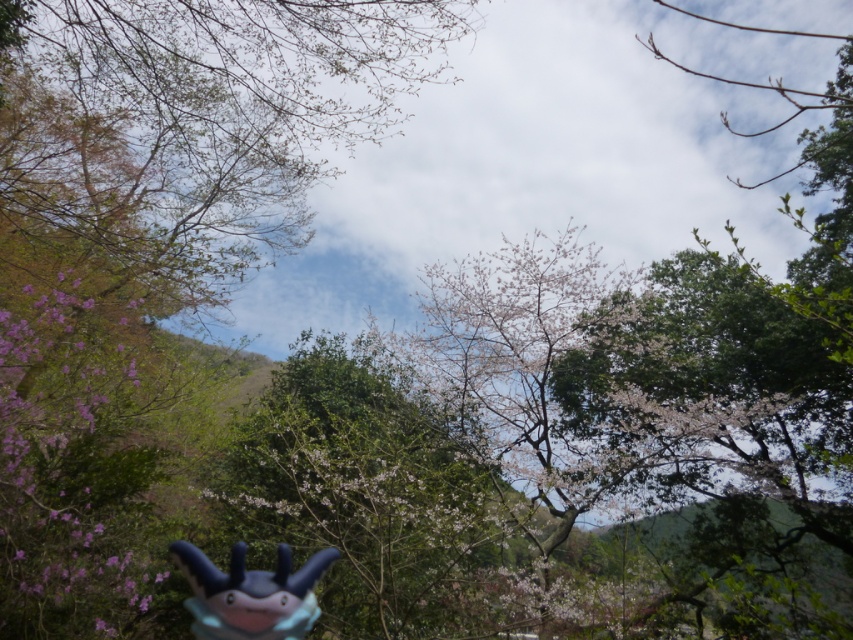
In the scene shown: You are a child playing in the garden and you see the pink matte flower at left and the matte blue plush toy at bottom center. Which object is positioned lower in the scene?

The pink matte flower at left is located below the matte blue plush toy at bottom center, so it is positioned lower in the scene.

You are a child playing in the park and you see the pink matte flower at left and the matte blue plush toy at bottom center. Which object is located to the left of the other?

→ The pink matte flower at left is positioned on the left side of the matte blue plush toy at bottom center, so the pink matte flower at left is to the left of the matte blue plush toy at bottom center.

You are a child playing in the garden and you want to place a small flag between the pink matte flower at left and the matte blue plush toy at bottom center. Which object should you place the flag closer to if you want the flag to be taller than both?

The pink matte flower at left is shorter than the matte blue plush toy at bottom center. To ensure the flag is taller than both, place it closer to the pink matte flower at left so it can be positioned between the shorter flower and the taller toy, allowing the flag to surpass both in height.